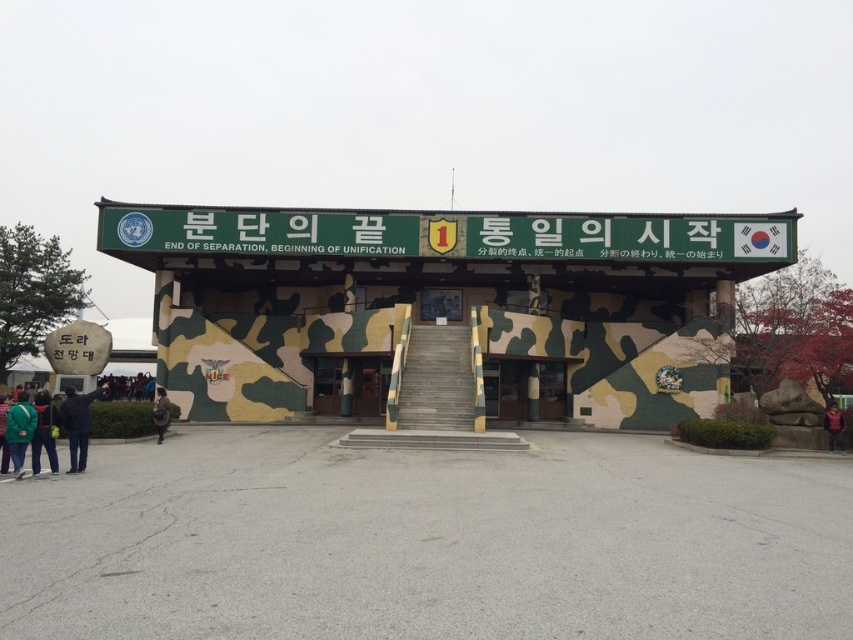
Question: Where is green camouflage door at center located in relation to dark blue jacket at center in the image?

Choices:
 (A) right
 (B) left

Answer: (B)

Question: Among these objects, which one is nearest to the camera?

Choices:
 (A) dark blue jeans at lower left
 (B) green camouflage door at center
 (C) dark blue jacket at lower left

Answer: (C)

Question: Is camouflage door at center bigger than dark blue jacket at center?

Choices:
 (A) no
 (B) yes

Answer: (B)

Question: Estimate the real-world distances between objects in this image. Which object is farther from the dark blue jacket at lower left?

Choices:
 (A) dark blue jeans at lower left
 (B) camouflage jacket at lower left
 (C) green matte jacket at lower left

Answer: (C)

Question: Among these points, which one is nearest to the camera?

Choices:
 (A) (30, 419)
 (B) (312, 394)
 (C) (78, 413)

Answer: (A)

Question: Is green camouflage door at center further to the viewer compared to camouflage jacket at lower left?

Choices:
 (A) no
 (B) yes

Answer: (B)